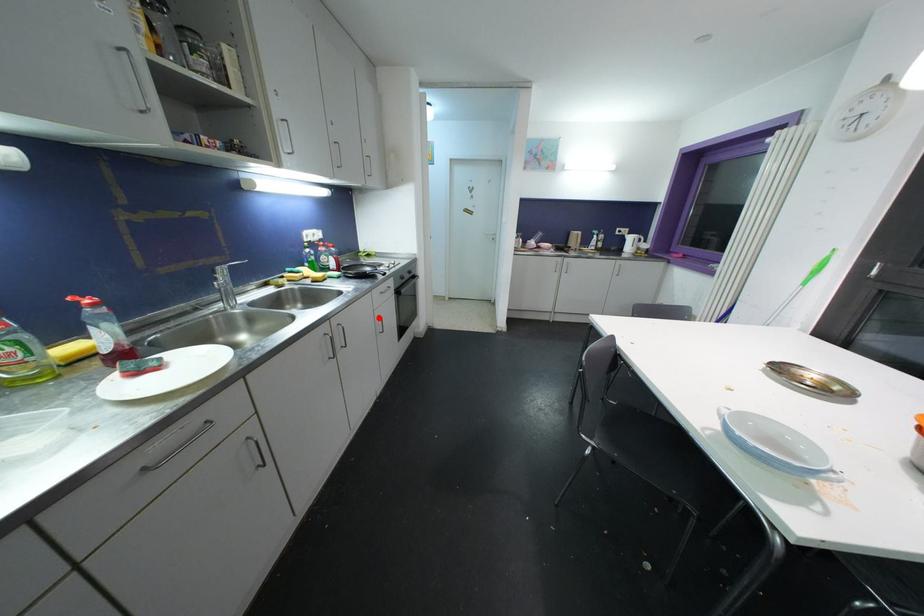
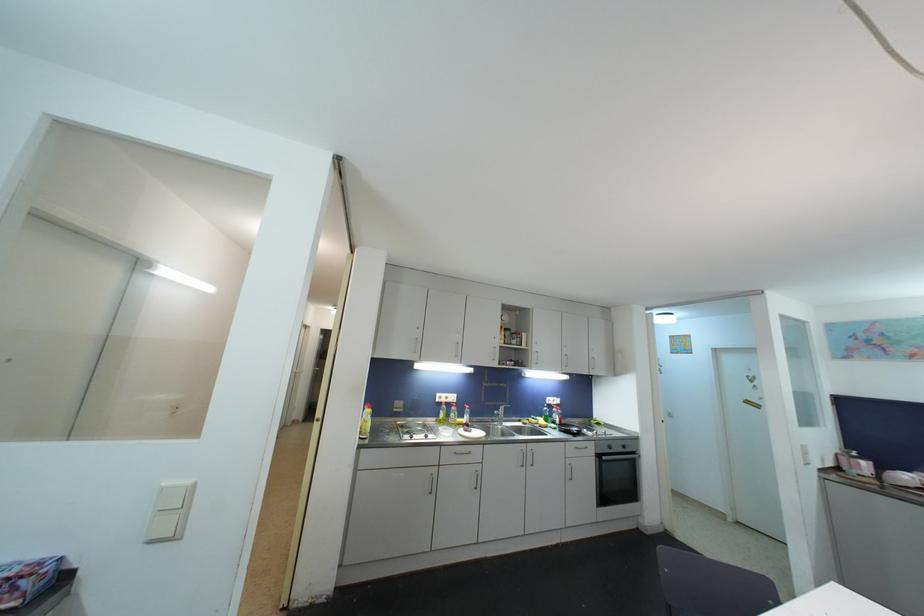
In the second image, find the point that corresponds to the highlighted location in the first image.

(570, 464)